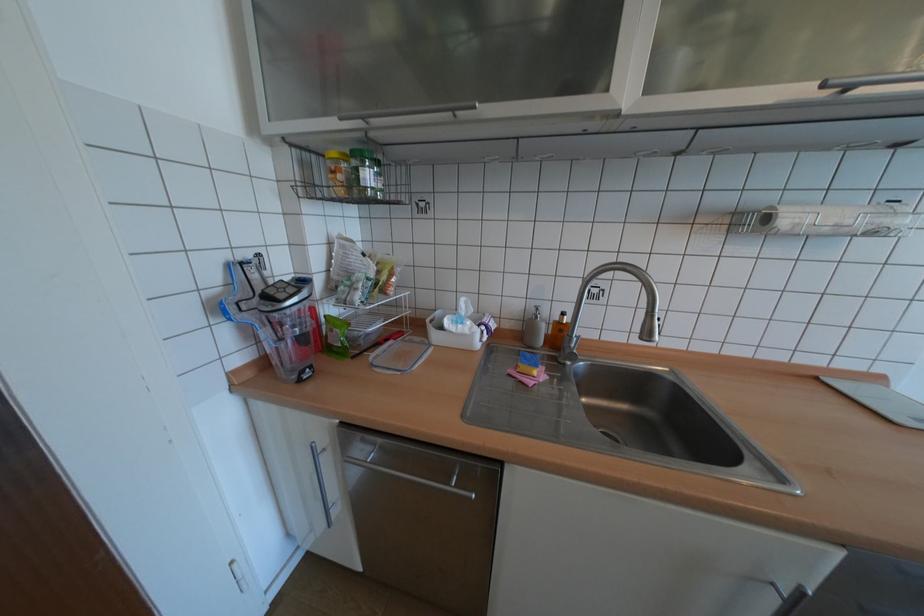
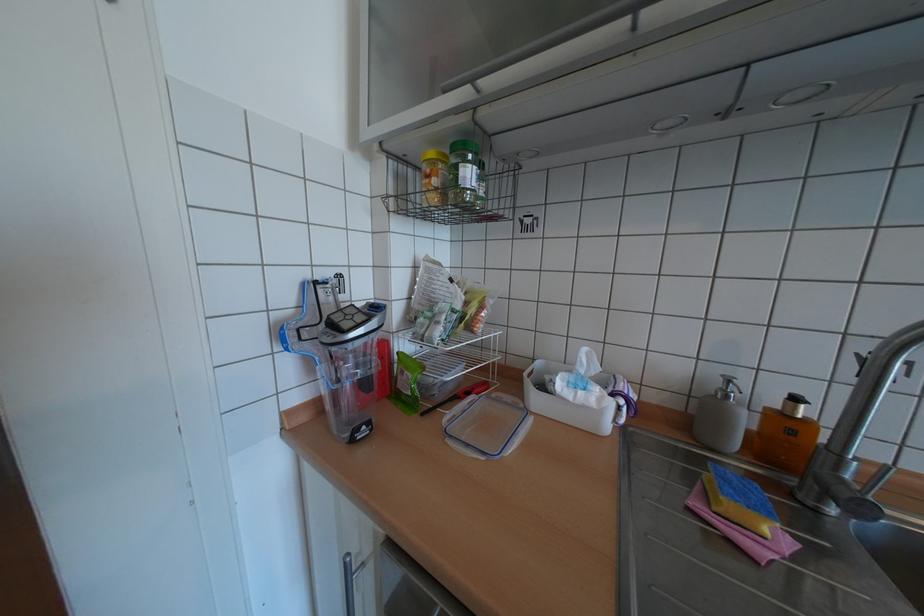
Find the pixel in the second image that matches [373,179] in the first image.

(473, 177)